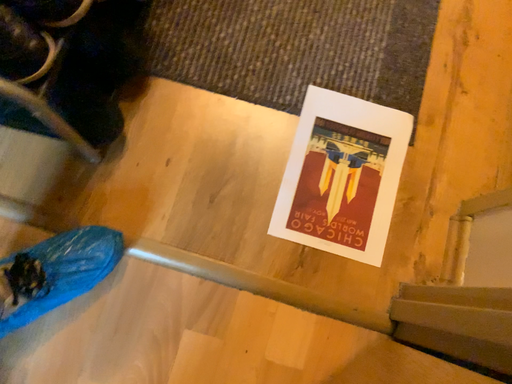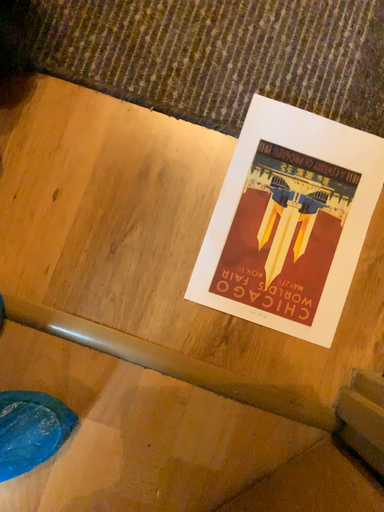
Question: How did the camera likely rotate when shooting the video?

Choices:
 (A) rotated downward
 (B) rotated upward

Answer: (A)